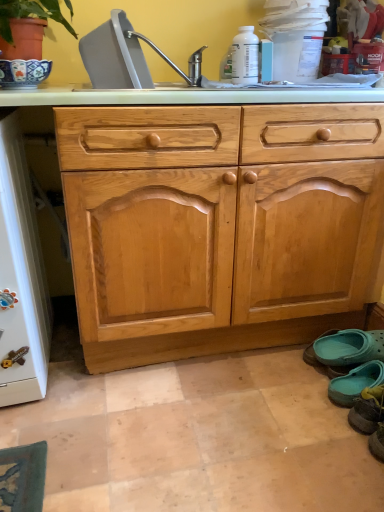
Question: Considering their positions, is gray plastic sink at upper center, which ranks as the first sink in front-to-back order, located in front of or behind teal rubber clogs at lower right, acting as the 1th footwear starting from the back?

Choices:
 (A) front
 (B) behind

Answer: (A)

Question: Considering the positions of point (102, 36) and point (377, 349), is point (102, 36) closer or farther from the camera than point (377, 349)?

Choices:
 (A) farther
 (B) closer

Answer: (B)

Question: Which of these objects is positioned closest to the gray plastic sink at upper center, placed as the 2th sink when sorted from back to front?

Choices:
 (A) teal fabric slipper at lower right, the second footwear when ordered from front to back
 (B) teal fabric slipper at lower right, arranged as the first footwear when viewed from the front
 (C) silver metallic faucet at upper center, acting as the first sink starting from the back
 (D) light brown wood drawer at center
 (E) white glossy refrigerator at left

Answer: (C)

Question: Estimate the real-world distances between objects in this image. Which object is farther from the light brown wood drawer at center?

Choices:
 (A) white glossy refrigerator at left
 (B) silver metallic faucet at upper center, the 2th sink from the front
 (C) teal fabric slipper at lower right, the second footwear when ordered from front to back
 (D) teal fabric slipper at lower right, arranged as the first footwear when viewed from the front
 (E) teal rubber clogs at lower right, acting as the 1th footwear starting from the back

Answer: (D)